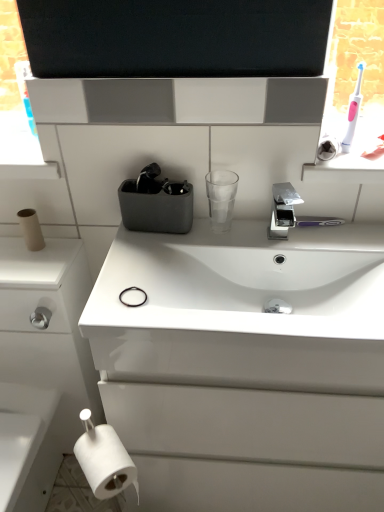
Find the location of a particular element. free space in front of transparent plastic cup at center is located at coordinates (209, 248).